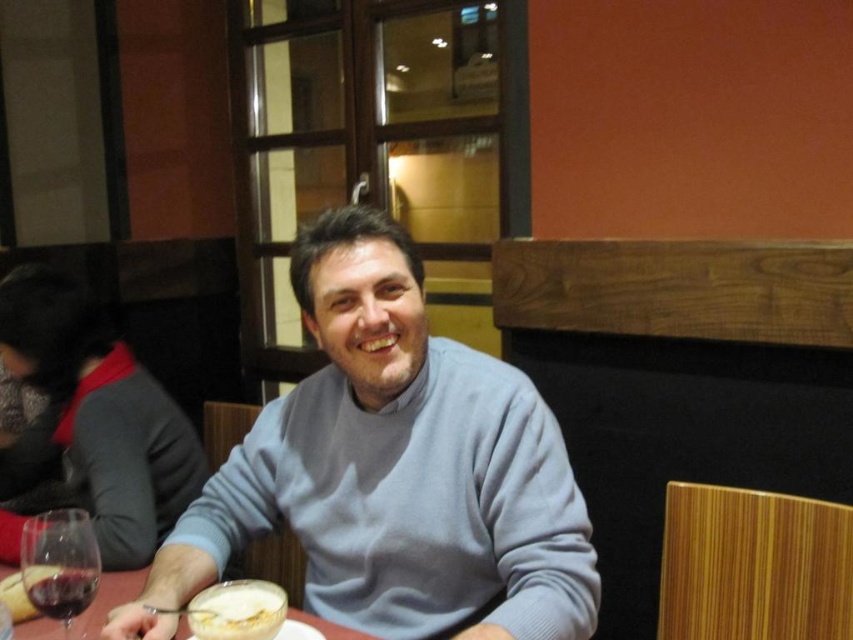
Consider the image. Can you confirm if white creamy soup at lower center is positioned above clear glass table at lower left?

Indeed, white creamy soup at lower center is positioned over clear glass table at lower left.

Does white creamy soup at lower center appear under clear glass table at lower left?

Incorrect, white creamy soup at lower center is not positioned below clear glass table at lower left.

Describe the element at coordinates (236, 611) in the screenshot. The image size is (853, 640). I see `white creamy soup at lower center` at that location.

Find the location of a particular element. The image size is (853, 640). white creamy soup at lower center is located at coordinates click(x=236, y=611).

Consider the image. Who is positioned more to the left, light blue sweater at center or translucent glass at lower left?

From the viewer's perspective, translucent glass at lower left appears more on the left side.

Describe the element at coordinates (392, 470) in the screenshot. I see `light blue sweater at center` at that location.

Where is `light blue sweater at center`? This screenshot has height=640, width=853. light blue sweater at center is located at coordinates (392, 470).

Between clear glass table at lower left and translucent glass at lower left, which one has more height?

translucent glass at lower left

From the picture: Is clear glass table at lower left shorter than translucent glass at lower left?

Indeed, clear glass table at lower left has a lesser height compared to translucent glass at lower left.

Does point (30, 637) come farther from viewer compared to point (49, 593)?

Yes, point (30, 637) is farther from viewer.

In order to click on clear glass table at lower left in this screenshot , I will do `click(112, 596)`.